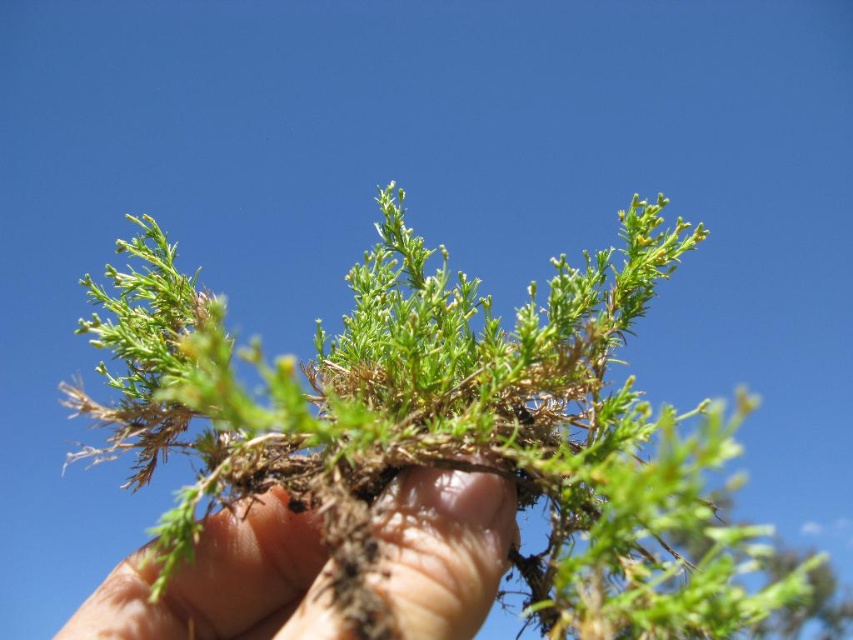
In the scene shown: Who is more distant from viewer, [136,419] or [415,545]?

The point [136,419] is behind.

Which of these two, green fibrous plant at center or dry soil at center, stands taller?

With more height is green fibrous plant at center.

Does point (252, 408) come closer to viewer compared to point (445, 506)?

Yes, it is in front of point (445, 506).

This screenshot has height=640, width=853. Identify the location of green fibrous plant at center. (447, 426).